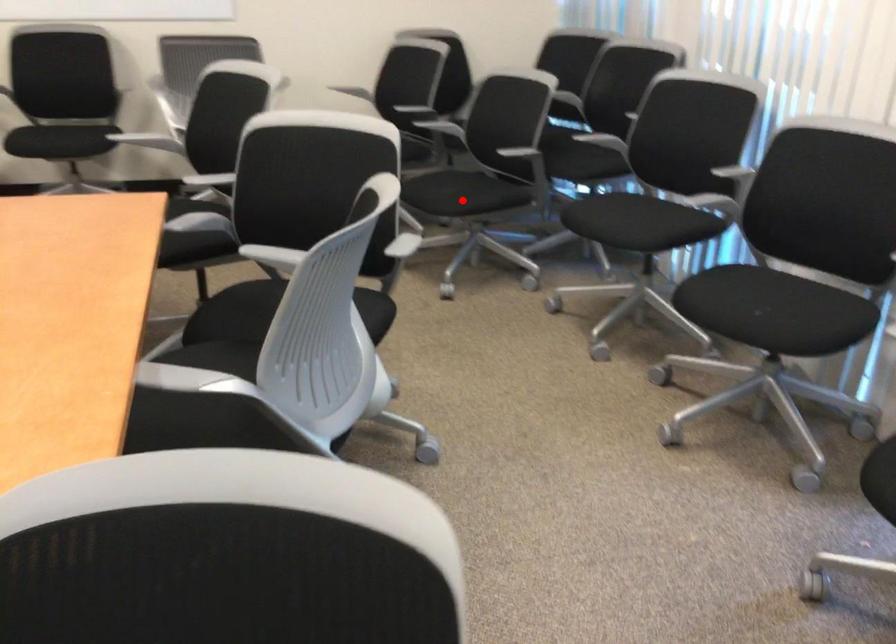
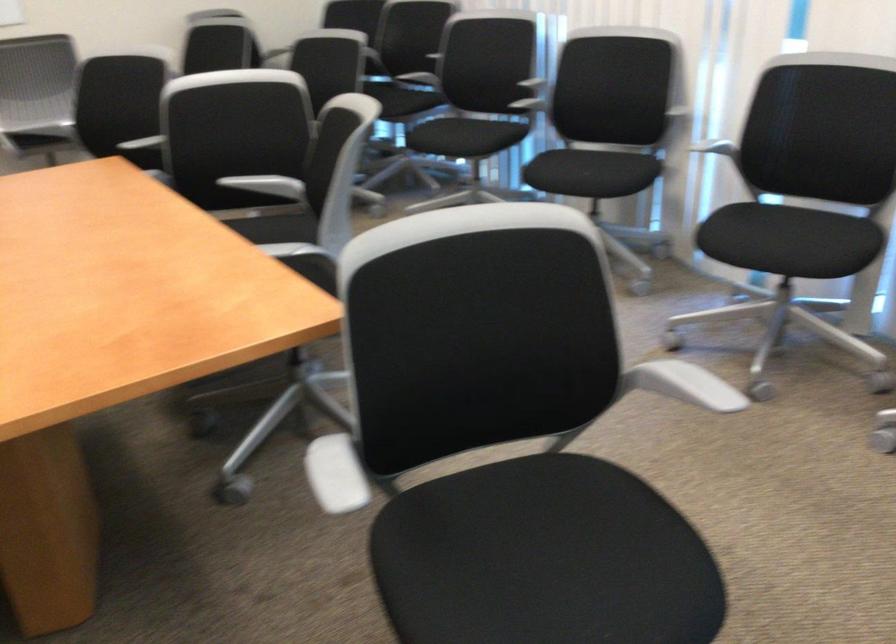
Question: I am providing you with two images of the same scene from different viewpoints. A red point is marked on the first image. At the location where the point appears in image 1, is it still visible in image 2?

Choices:
 (A) Yes
 (B) No

Answer: (B)